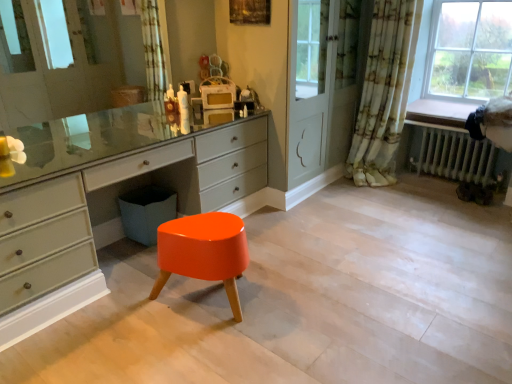
What is the approximate height of metallic radiator at lower right?

metallic radiator at lower right is 17.66 inches in height.

This screenshot has width=512, height=384. What are the coordinates of `metallic radiator at lower right` in the screenshot? It's located at (454, 155).

What is the approximate height of glossy orange stool at center?

The height of glossy orange stool at center is 16.94 inches.

Measure the distance between point (485, 137) and camera.

Point (485, 137) and camera are 3.17 meters apart from each other.

This screenshot has height=384, width=512. Describe the element at coordinates (493, 122) in the screenshot. I see `velvet black swivel chair at right` at that location.

Locate an element on the screen. metallic radiator at lower right is located at coordinates (454, 155).

Who is bigger, metallic radiator at lower right or glossy orange stool at center?

glossy orange stool at center is bigger.

How far apart are metallic radiator at lower right and glossy orange stool at center?

2.21 meters.

Considering the relative sizes of metallic radiator at lower right and glossy orange stool at center in the image provided, is metallic radiator at lower right taller than glossy orange stool at center?

Correct, metallic radiator at lower right is much taller as glossy orange stool at center.

Considering the relative positions of metallic radiator at lower right and glossy orange stool at center in the image provided, is metallic radiator at lower right to the left or to the right of glossy orange stool at center?

From the image, it's evident that metallic radiator at lower right is to the right of glossy orange stool at center.

Is point (158, 292) less distant than point (26, 293)?

No, (158, 292) is behind (26, 293).

Is glossy orange stool at center not near matte gray chest of drawers at center?

glossy orange stool at center is actually quite close to matte gray chest of drawers at center.

Is glossy orange stool at center smaller than matte gray chest of drawers at center?

Indeed, glossy orange stool at center has a smaller size compared to matte gray chest of drawers at center.

Is glossy orange stool at center oriented away from matte gray chest of drawers at center?

glossy orange stool at center is not turned away from matte gray chest of drawers at center.

In terms of height, does metallic radiator at lower right look taller or shorter compared to matte gray chest of drawers at center?

metallic radiator at lower right is shorter than matte gray chest of drawers at center.

Is matte gray chest of drawers at center at the back of metallic radiator at lower right?

No.

Identify the location of the chest of drawers that appears in front of the metallic radiator at lower right. The image size is (512, 384). (104, 224).

From a real-world perspective, who is located higher, metallic radiator at lower right or matte gray chest of drawers at center?

matte gray chest of drawers at center is physically above.

In terms of height, does matte gray chest of drawers at center look taller or shorter compared to velvet black swivel chair at right?

Clearly, matte gray chest of drawers at center is taller compared to velvet black swivel chair at right.

How different are the orientations of matte gray chest of drawers at center and velvet black swivel chair at right in degrees?

They differ by 92.9 degrees in their facing directions.

Could you tell me if matte gray chest of drawers at center is facing velvet black swivel chair at right?

No, matte gray chest of drawers at center is not turned towards velvet black swivel chair at right.

Considering the sizes of matte gray chest of drawers at center and velvet black swivel chair at right in the image, is matte gray chest of drawers at center bigger or smaller than velvet black swivel chair at right?

matte gray chest of drawers at center is bigger than velvet black swivel chair at right.

Considering the positions of objects floral fabric curtain at right and metallic radiator at lower right in the image provided, who is more to the right, floral fabric curtain at right or metallic radiator at lower right?

From the viewer's perspective, metallic radiator at lower right appears more on the right side.

What's the angular difference between floral fabric curtain at right and metallic radiator at lower right's facing directions?

The angle between the facing direction of floral fabric curtain at right and the facing direction of metallic radiator at lower right is 94.3 degrees.

Are floral fabric curtain at right and metallic radiator at lower right located far from each other?

floral fabric curtain at right is near metallic radiator at lower right, not far away.

Find the location of a particular element. The height and width of the screenshot is (384, 512). curtain in front of the metallic radiator at lower right is located at coordinates (384, 92).

From their relative heights in the image, would you say velvet black swivel chair at right is taller or shorter than matte gray chest of drawers at center?

Clearly, velvet black swivel chair at right is shorter compared to matte gray chest of drawers at center.

From the image's perspective, relative to matte gray chest of drawers at center, is velvet black swivel chair at right above or below?

From the image's perspective, velvet black swivel chair at right appears above matte gray chest of drawers at center.

In the image, is velvet black swivel chair at right positioned in front of or behind matte gray chest of drawers at center?

velvet black swivel chair at right is behind matte gray chest of drawers at center.

Does velvet black swivel chair at right turn towards matte gray chest of drawers at center?

No, velvet black swivel chair at right is not turned towards matte gray chest of drawers at center.

Does matte gray chest of drawers at center have a lesser height compared to glossy orange stool at center?

Incorrect, the height of matte gray chest of drawers at center does not fall short of that of glossy orange stool at center.

Is matte gray chest of drawers at center looking in the opposite direction of glossy orange stool at center?

Yes, glossy orange stool at center is at the back of matte gray chest of drawers at center.

Is matte gray chest of drawers at center positioned beyond the bounds of glossy orange stool at center?

Indeed, matte gray chest of drawers at center is completely outside glossy orange stool at center.

Would you say matte gray chest of drawers at center is a long distance from glossy orange stool at center?

That's not correct — matte gray chest of drawers at center is a little close to glossy orange stool at center.

Locate an element on the screen. The width and height of the screenshot is (512, 384). radiator above the glossy orange stool at center (from a real-world perspective) is located at coordinates (454, 155).

I want to click on the chest of drawers in front of the glossy orange stool at center, so click(104, 224).

Looking at the image, which one is located closer to floral fabric curtain at right, metallic radiator at lower right or matte gray chest of drawers at center?

metallic radiator at lower right is closer to floral fabric curtain at right.

Looking at the image, which one is located closer to matte gray chest of drawers at center, velvet black swivel chair at right or metallic radiator at lower right?

The object closer to matte gray chest of drawers at center is metallic radiator at lower right.

Considering their positions, is matte gray chest of drawers at center positioned closer to glossy orange stool at center than metallic radiator at lower right?

Among the two, matte gray chest of drawers at center is located nearer to glossy orange stool at center.

Consider the image. Looking at the image, which one is located closer to velvet black swivel chair at right, floral fabric curtain at right or metallic radiator at lower right?

metallic radiator at lower right is closer to velvet black swivel chair at right.

Considering their positions, is glossy orange stool at center positioned closer to matte gray chest of drawers at center than floral fabric curtain at right?

glossy orange stool at center is positioned closer to the anchor matte gray chest of drawers at center.

When comparing their distances from floral fabric curtain at right, does matte gray chest of drawers at center or metallic radiator at lower right seem closer?

Based on the image, metallic radiator at lower right appears to be nearer to floral fabric curtain at right.

Estimate the real-world distances between objects in this image. Which object is further from velvet black swivel chair at right, glossy orange stool at center or metallic radiator at lower right?

Based on the image, glossy orange stool at center appears to be further to velvet black swivel chair at right.

Considering their positions, is floral fabric curtain at right positioned closer to glossy orange stool at center than matte gray chest of drawers at center?

matte gray chest of drawers at center.

You are a GUI agent. You are given a task and a screenshot of the screen. Output one action in this format:
    pyautogui.click(x=<x>, y=<y>)
    Task: Click on the stool between matte gray chest of drawers at center and velvet black swivel chair at right
    
    Given the screenshot: What is the action you would take?
    pyautogui.click(x=203, y=252)

The width and height of the screenshot is (512, 384). What are the coordinates of `stool between matte gray chest of drawers at center and floral fabric curtain at right from left to right` in the screenshot? It's located at (203, 252).

You are a GUI agent. You are given a task and a screenshot of the screen. Output one action in this format:
    pyautogui.click(x=<x>, y=<y>)
    Task: Click on the stool between matte gray chest of drawers at center and metallic radiator at lower right from left to right
    This screenshot has height=384, width=512.
    Given the screenshot: What is the action you would take?
    pyautogui.click(x=203, y=252)

I want to click on radiator between floral fabric curtain at right and velvet black swivel chair at right, so click(x=454, y=155).